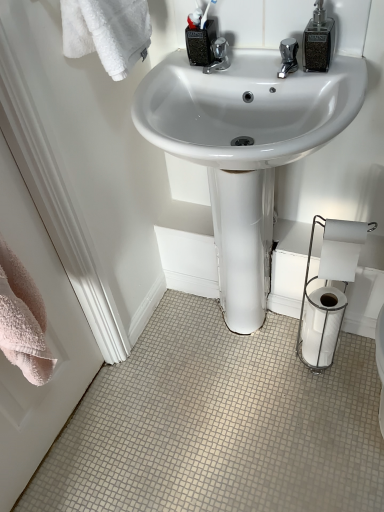
Question: Is white glossy toilet paper at lower right, which is the 1th toilet paper in bottom-to-top order, in front of or behind white glossy sink at center in the image?

Choices:
 (A) front
 (B) behind

Answer: (B)

Question: Looking at the image, does white glossy toilet paper at lower right, which is the 1th toilet paper in bottom-to-top order, seem bigger or smaller compared to white glossy sink at center?

Choices:
 (A) big
 (B) small

Answer: (B)

Question: Which object is the closest to the matte black soap dispenser at upper right?

Choices:
 (A) white glossy toilet paper at lower right, which is the 1th toilet paper in bottom-to-top order
 (B) white paper at lower right, arranged as the 2th toilet paper when ordered from the bottom
 (C) white matte toilet paper at lower right, the first toilet paper from the top
 (D) matte black container at upper center
 (E) pink towel at left

Answer: (D)

Question: Estimate the real-world distances between objects in this image. Which object is closer to the white paper at lower right, arranged as the 2th toilet paper when ordered from the bottom?

Choices:
 (A) pink towel at left
 (B) matte black soap dispenser at upper right
 (C) white glossy sink at center
 (D) matte black container at upper center
 (E) white matte toilet paper at lower right, the first toilet paper from the top

Answer: (E)